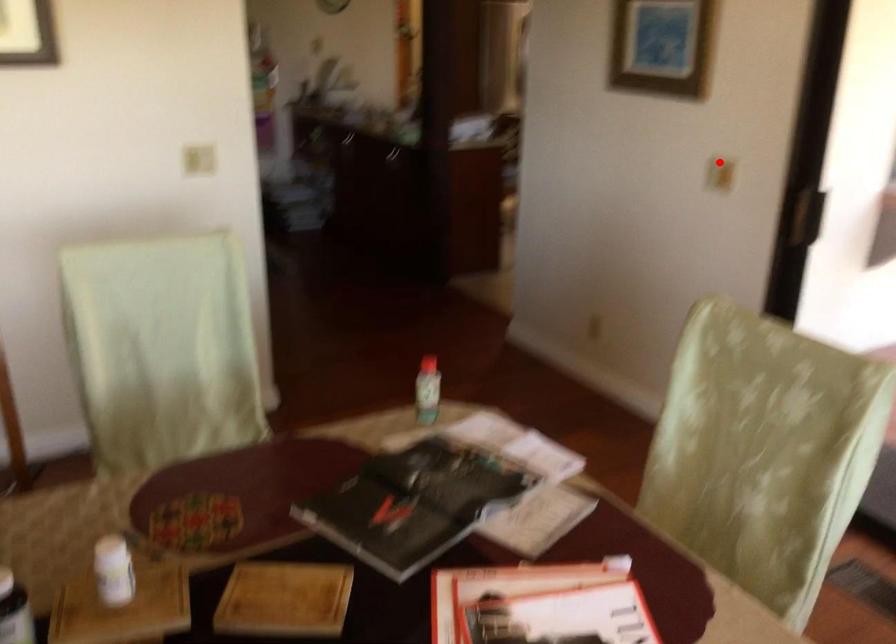
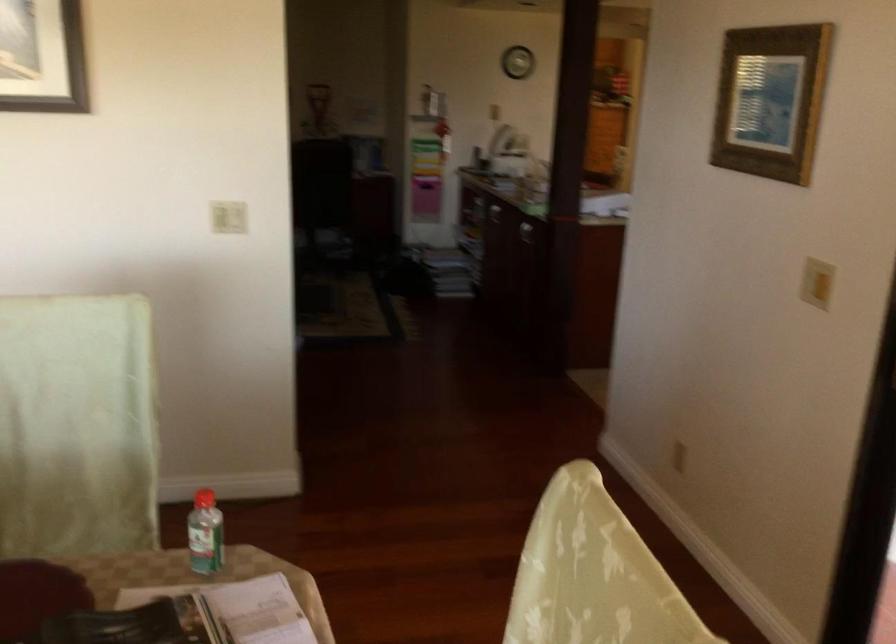
Question: I am providing you with two images of the same scene from different viewpoints. In image1, a red point is highlighted. Considering the same 3D point in image2, which of the following is correct?

Choices:
 (A) It is closer
 (B) It is farther

Answer: (A)